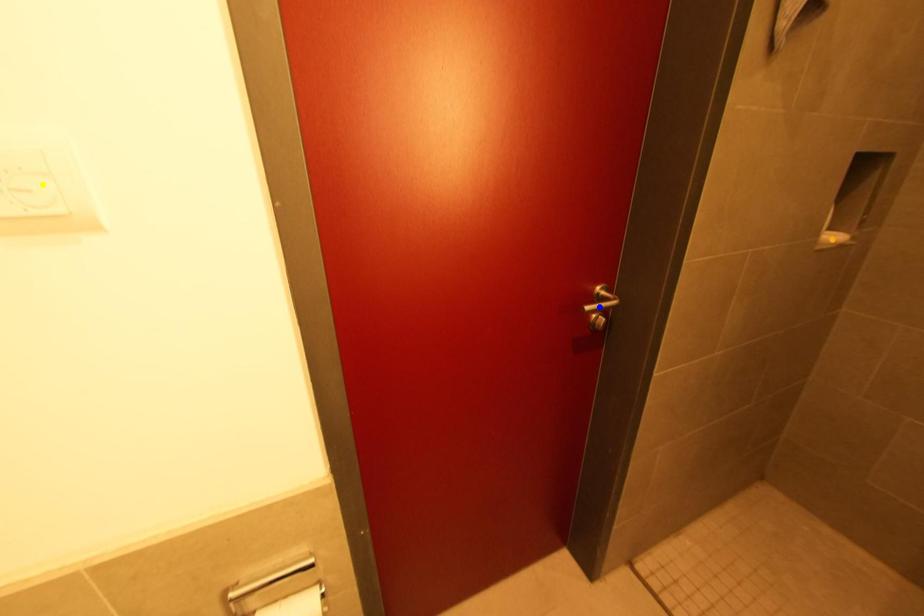
Order these from nearest to farthest:
yellow point, blue point, orange point

yellow point → blue point → orange point